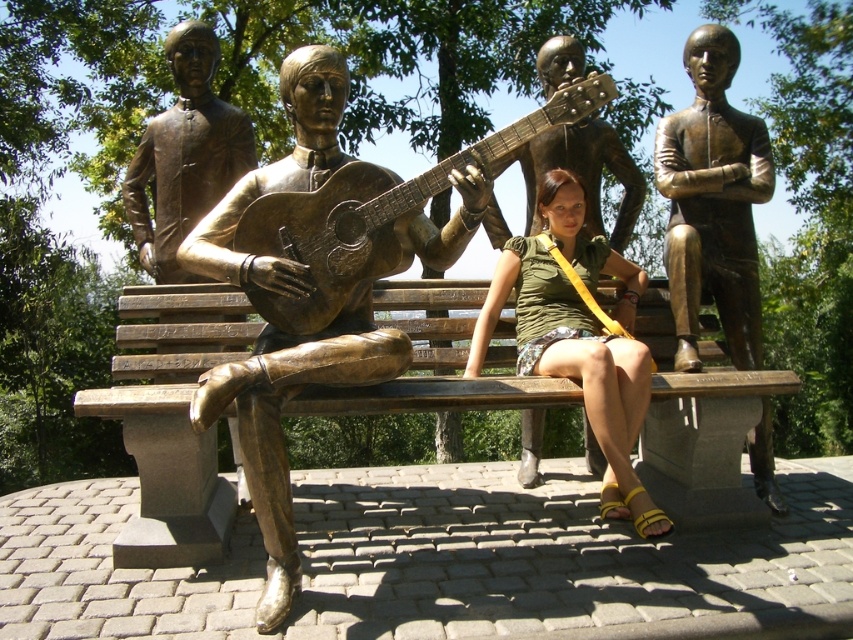
In the scene shown: Can you confirm if bronze bench at center is bigger than bronze statue of man playing guitar at center?

Actually, bronze bench at center might be smaller than bronze statue of man playing guitar at center.

Can you confirm if bronze bench at center is positioned above bronze statue of man playing guitar at center?

Actually, bronze bench at center is below bronze statue of man playing guitar at center.

Does point (119, 298) come closer to viewer compared to point (219, 116)?

Yes, point (119, 298) is closer to viewer.

This screenshot has width=853, height=640. I want to click on bronze bench at center, so tap(169, 394).

Is bronze textured guitar at center shorter than bronze statue of man playing guitar at center?

Yes.

Does bronze textured guitar at center appear on the left side of bronze statue of man playing guitar at center?

Incorrect, bronze textured guitar at center is not on the left side of bronze statue of man playing guitar at center.

What do you see at coordinates (375, 212) in the screenshot? The height and width of the screenshot is (640, 853). I see `bronze textured guitar at center` at bounding box center [375, 212].

Identify the location of bronze textured guitar at center. (375, 212).

Can you confirm if bronze statue at right is thinner than bronze textured guitar at center?

Correct, bronze statue at right's width is less than bronze textured guitar at center's.

You are a GUI agent. You are given a task and a screenshot of the screen. Output one action in this format:
    pyautogui.click(x=<x>, y=<y>)
    Task: Click on the bronze statue at right
    The height and width of the screenshot is (640, 853).
    Given the screenshot: What is the action you would take?
    pyautogui.click(x=712, y=202)